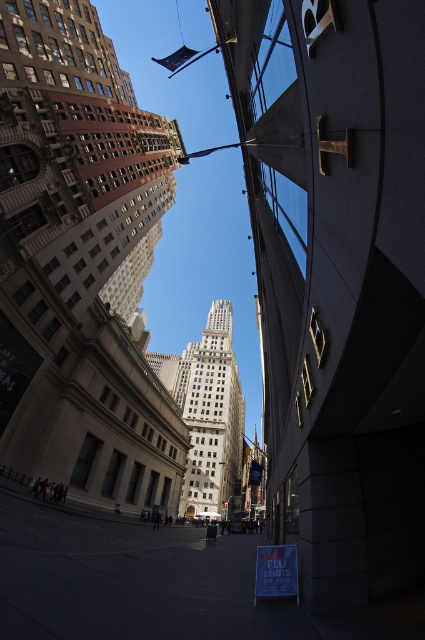
Question: Among these objects, which one is nearest to the camera?

Choices:
 (A) brown stone skyscraper at center
 (B) white marble tower at center

Answer: (A)

Question: Is brown stone skyscraper at center to the right of white marble tower at center from the viewer's perspective?

Choices:
 (A) yes
 (B) no

Answer: (B)

Question: Which object appears farthest from the camera in this image?

Choices:
 (A) brown stone skyscraper at center
 (B) white marble tower at center
 (C) dark gray concrete skyscraper at center

Answer: (B)

Question: Among these points, which one is nearest to the camera?

Choices:
 (A) (210, 392)
 (B) (266, 422)
 (C) (62, 452)

Answer: (C)

Question: Does dark gray concrete skyscraper at center have a greater width compared to brown stone skyscraper at center?

Choices:
 (A) yes
 (B) no

Answer: (B)

Question: Is dark gray concrete skyscraper at center above brown stone skyscraper at center?

Choices:
 (A) yes
 (B) no

Answer: (B)